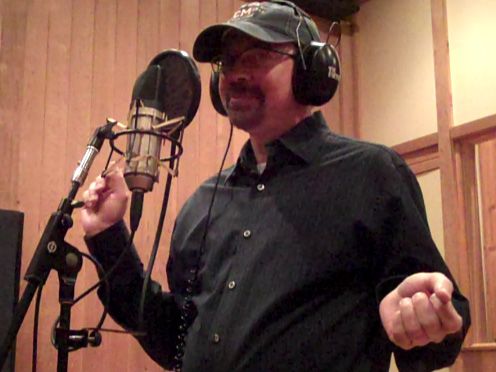
Identify the location of yellow wall. This screenshot has width=496, height=372. (407, 96).